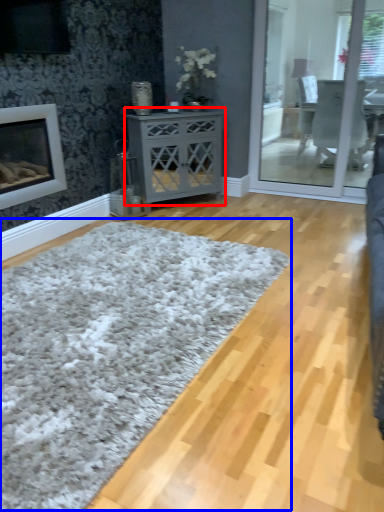
Question: Which point is closer to the camera, nightstand (highlighted by a red box) or plain (highlighted by a blue box)?

Choices:
 (A) nightstand
 (B) plain

Answer: (B)